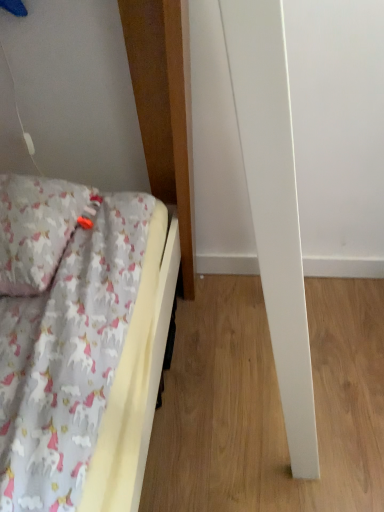
Where is `fluffy cotton pillow at left`? The image size is (384, 512). fluffy cotton pillow at left is located at coordinates (37, 228).

Image resolution: width=384 pixels, height=512 pixels. What do you see at coordinates (37, 228) in the screenshot?
I see `fluffy cotton pillow at left` at bounding box center [37, 228].

The height and width of the screenshot is (512, 384). I want to click on fluffy cotton pillow at left, so click(x=37, y=228).